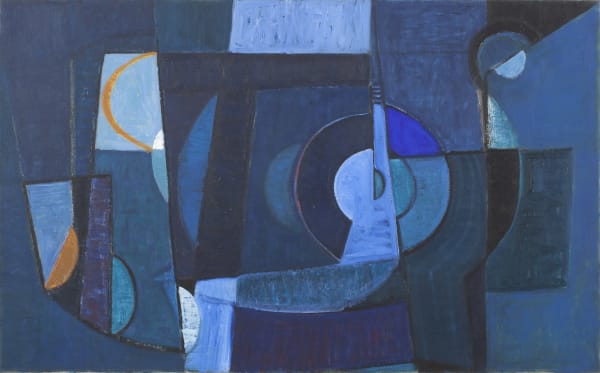
You are a GUI agent. You are given a task and a screenshot of the screen. Output one action in this format:
    pyautogui.click(x=<x>, y=<y>)
    Task: Click on the abstract art
    This screenshot has height=373, width=600.
    Given the screenshot: What is the action you would take?
    pyautogui.click(x=412, y=25)